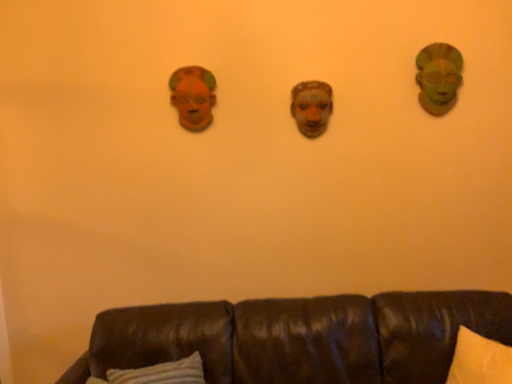
Question: Can you confirm if matte orange mask at upper left is smaller than green matte mask at upper right?

Choices:
 (A) no
 (B) yes

Answer: (B)

Question: From a real-world perspective, is matte orange mask at upper left located beneath green matte mask at upper right?

Choices:
 (A) yes
 (B) no

Answer: (A)

Question: Is matte orange mask at upper left taller than green matte mask at upper right?

Choices:
 (A) yes
 (B) no

Answer: (B)

Question: From the image's perspective, is matte orange mask at upper left on green matte mask at upper right?

Choices:
 (A) no
 (B) yes

Answer: (A)

Question: From a real-world perspective, is matte orange mask at upper left on top of green matte mask at upper right?

Choices:
 (A) yes
 (B) no

Answer: (B)

Question: Would you say matte orange mask at upper left contains green matte mask at upper right?

Choices:
 (A) yes
 (B) no

Answer: (B)

Question: Is matte clay mask at center located within brown leather couch at lower center?

Choices:
 (A) yes
 (B) no

Answer: (B)

Question: Does brown leather couch at lower center lie behind matte clay mask at center?

Choices:
 (A) yes
 (B) no

Answer: (B)

Question: Can you confirm if brown leather couch at lower center is thinner than matte clay mask at center?

Choices:
 (A) yes
 (B) no

Answer: (B)

Question: Is brown leather couch at lower center taller than matte clay mask at center?

Choices:
 (A) no
 (B) yes

Answer: (B)

Question: Is brown leather couch at lower center touching matte clay mask at center?

Choices:
 (A) yes
 (B) no

Answer: (B)

Question: Does brown leather couch at lower center have a lesser height compared to matte clay mask at center?

Choices:
 (A) no
 (B) yes

Answer: (A)

Question: Is green matte mask at upper right facing away from matte clay mask at center?

Choices:
 (A) no
 (B) yes

Answer: (A)